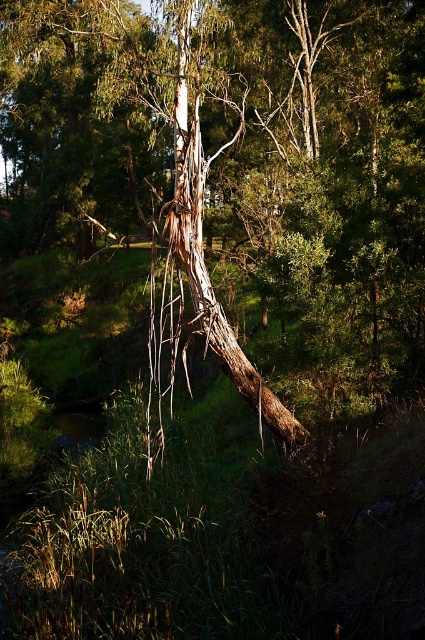
Question: Which point is closer to the camera?

Choices:
 (A) brown bark tree at center
 (B) brown rough bark tree trunk at center

Answer: (A)

Question: Considering the relative positions of brown bark tree at center and brown rough bark tree trunk at center in the image provided, where is brown bark tree at center located with respect to brown rough bark tree trunk at center?

Choices:
 (A) right
 (B) left

Answer: (B)

Question: Can you confirm if brown bark tree at center is thinner than brown rough bark tree trunk at center?

Choices:
 (A) yes
 (B) no

Answer: (B)

Question: Can you confirm if brown bark tree at center is thinner than brown rough bark tree trunk at center?

Choices:
 (A) yes
 (B) no

Answer: (B)

Question: Which point is farther to the camera?

Choices:
 (A) brown bark tree at center
 (B) brown rough bark tree trunk at center

Answer: (B)